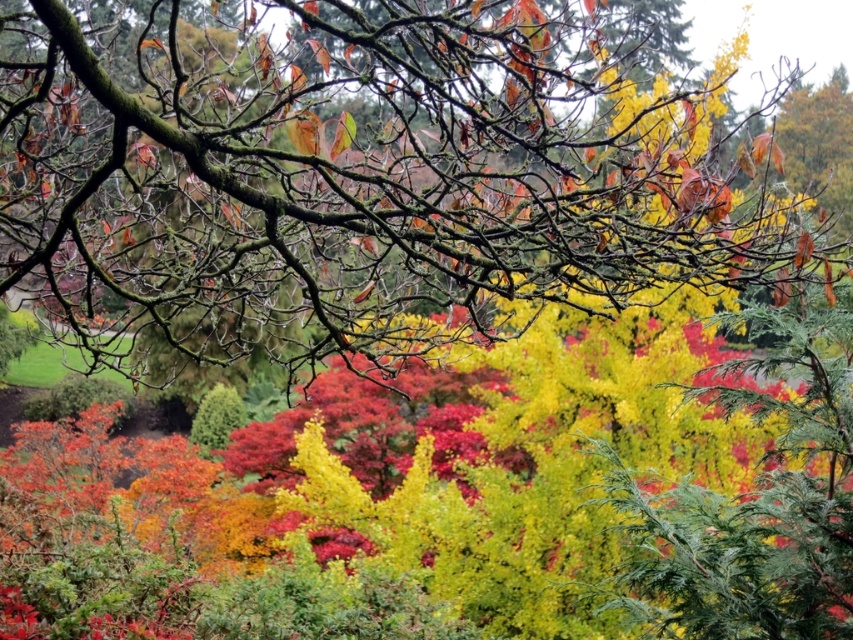
Based on the photo, can you confirm if smooth bark tree at center is positioned to the left of green matte bush at center?

In fact, smooth bark tree at center is to the right of green matte bush at center.

Does point (224, 170) come in front of point (218, 420)?

That is True.

You are a GUI agent. You are given a task and a screenshot of the screen. Output one action in this format:
    pyautogui.click(x=<x>, y=<y>)
    Task: Click on the smooth bark tree at center
    This screenshot has height=640, width=853.
    Given the screenshot: What is the action you would take?
    pyautogui.click(x=363, y=173)